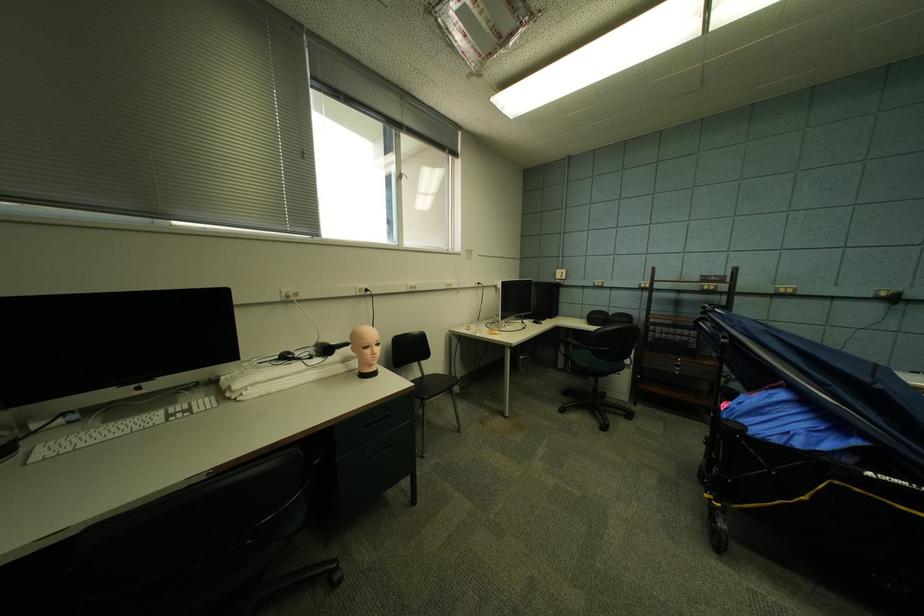
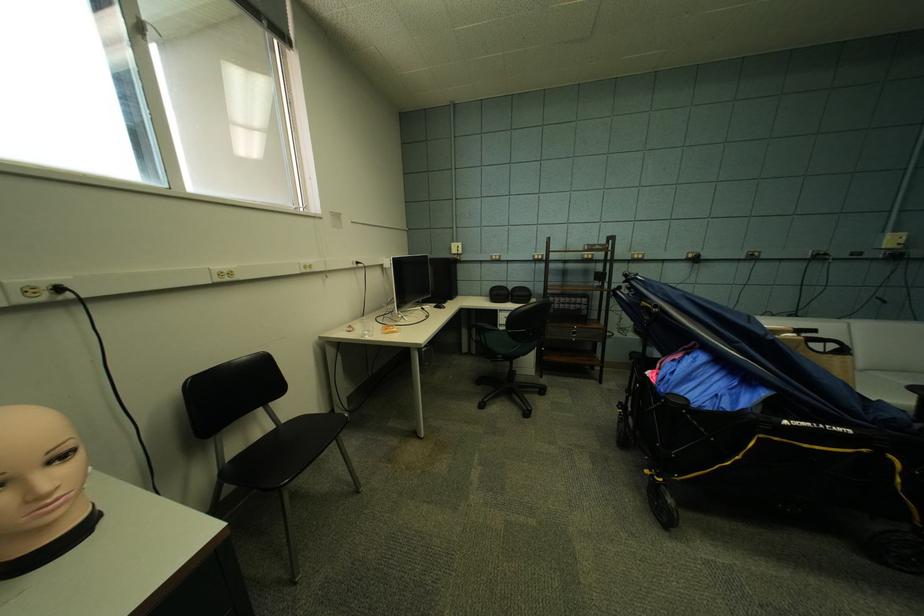
The point at [386,346] is marked in the first image. Where is the corresponding point in the second image?

(70, 459)